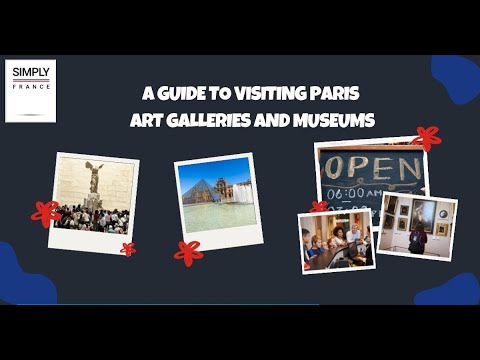
The height and width of the screenshot is (360, 480). I want to click on pictures, so click(x=90, y=215), click(x=228, y=206), click(x=332, y=244), click(x=410, y=226), click(x=353, y=189).